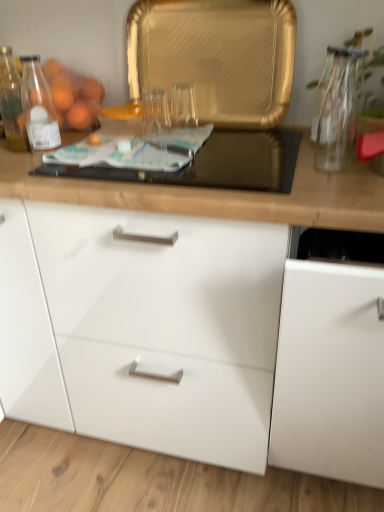
Question: From the image's perspective, is translucent glass bottle at left beneath transparent glass vase at upper right?

Choices:
 (A) yes
 (B) no

Answer: (B)

Question: Is translucent glass bottle at left behind transparent glass vase at upper right?

Choices:
 (A) no
 (B) yes

Answer: (B)

Question: Considering the relative sizes of translucent glass bottle at left and transparent glass vase at upper right in the image provided, is translucent glass bottle at left thinner than transparent glass vase at upper right?

Choices:
 (A) no
 (B) yes

Answer: (B)

Question: Considering the relative sizes of translucent glass bottle at left and transparent glass vase at upper right in the image provided, is translucent glass bottle at left wider than transparent glass vase at upper right?

Choices:
 (A) yes
 (B) no

Answer: (B)

Question: Is translucent glass bottle at left taller than transparent glass vase at upper right?

Choices:
 (A) no
 (B) yes

Answer: (A)

Question: From a real-world perspective, is transparent glass vase at upper right positioned above or below black glass gas stove at center?

Choices:
 (A) above
 (B) below

Answer: (A)

Question: In terms of width, does transparent glass vase at upper right look wider or thinner when compared to black glass gas stove at center?

Choices:
 (A) thin
 (B) wide

Answer: (A)

Question: Which is correct: transparent glass vase at upper right is inside black glass gas stove at center, or outside of it?

Choices:
 (A) outside
 (B) inside

Answer: (A)

Question: From the image's perspective, is transparent glass vase at upper right located above or below black glass gas stove at center?

Choices:
 (A) above
 (B) below

Answer: (A)

Question: Which is correct: white glossy cabinet at center, which is the 1th cabinetry from left to right, is inside orange matte plastic bag at upper left, or outside of it?

Choices:
 (A) inside
 (B) outside

Answer: (B)

Question: From their relative heights in the image, would you say white glossy cabinet at center, positioned as the 2th cabinetry in right-to-left order, is taller or shorter than orange matte plastic bag at upper left?

Choices:
 (A) tall
 (B) short

Answer: (A)

Question: From a real-world perspective, is white glossy cabinet at center, positioned as the 2th cabinetry in right-to-left order, above or below orange matte plastic bag at upper left?

Choices:
 (A) above
 (B) below

Answer: (B)

Question: Considering the positions of point (216, 417) and point (99, 96), is point (216, 417) closer or farther from the camera than point (99, 96)?

Choices:
 (A) closer
 (B) farther

Answer: (A)

Question: Is translucent glass bottle at left in front of or behind white glossy cabinet at right, the 1th cabinetry viewed from the right, in the image?

Choices:
 (A) front
 (B) behind

Answer: (B)

Question: Looking at the image, does translucent glass bottle at left seem bigger or smaller compared to white glossy cabinet at right, which is the 2th cabinetry in left-to-right order?

Choices:
 (A) small
 (B) big

Answer: (A)